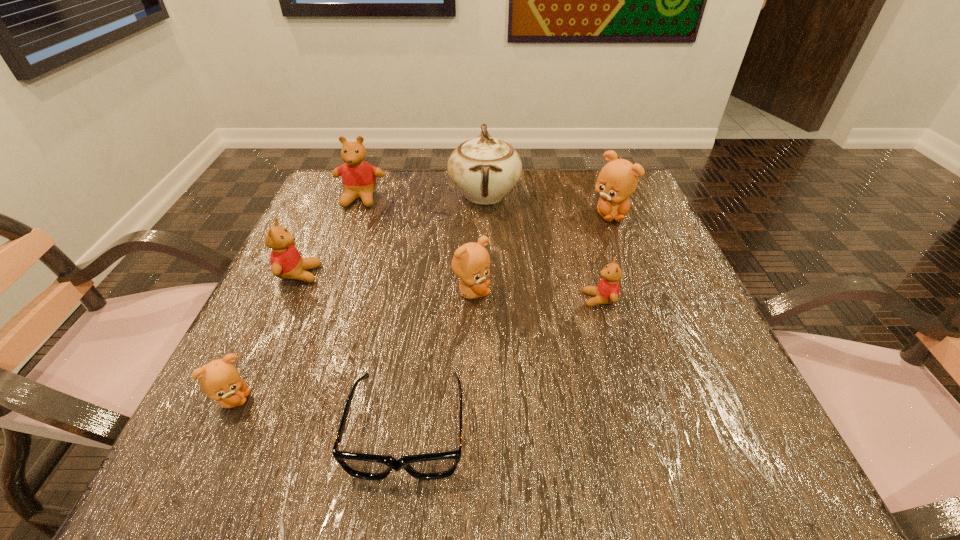
The height and width of the screenshot is (540, 960). What are the coordinates of `the second object from right to left` in the screenshot? It's located at (607, 292).

What are the coordinates of `the shortest object` in the screenshot? It's located at 431,466.

Where is `black sunglasses`? The image size is (960, 540). black sunglasses is located at coordinates (431, 466).

The height and width of the screenshot is (540, 960). In order to click on vacant space located 0.260m on the right of the white chinaware in this screenshot , I will do `click(626, 194)`.

Where is `vacant area situated 0.160m on the front-facing side of the farthest red teddy bear`? vacant area situated 0.160m on the front-facing side of the farthest red teddy bear is located at coordinates (340, 253).

Identify the location of vacant space located on the face of the rightmost brown teddy bear. (643, 301).

This screenshot has height=540, width=960. Identify the location of vacant space located on the front-facing side of the second smallest red teddy bear. (482, 274).

Image resolution: width=960 pixels, height=540 pixels. I want to click on vacant space situated on the face of the second biggest brown teddy bear, so click(639, 292).

The image size is (960, 540). In order to click on vacant space located on the face of the leftmost brown teddy bear in this screenshot , I will do `click(318, 400)`.

Identify the location of free point located on the front-facing side of the seventh object from left to right. (389, 300).